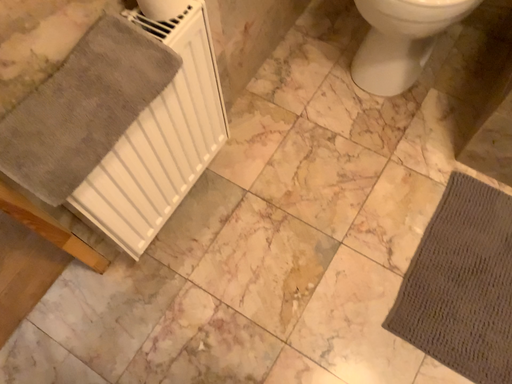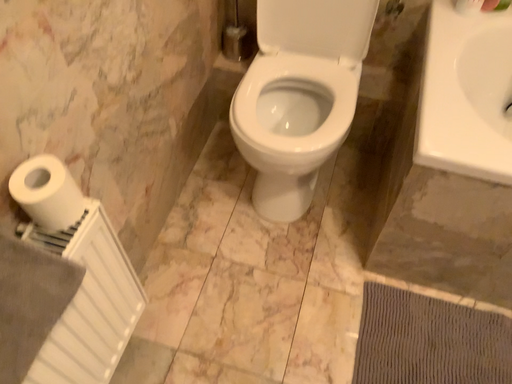
Question: How did the camera likely rotate when shooting the video?

Choices:
 (A) rotated right
 (B) rotated left

Answer: (A)